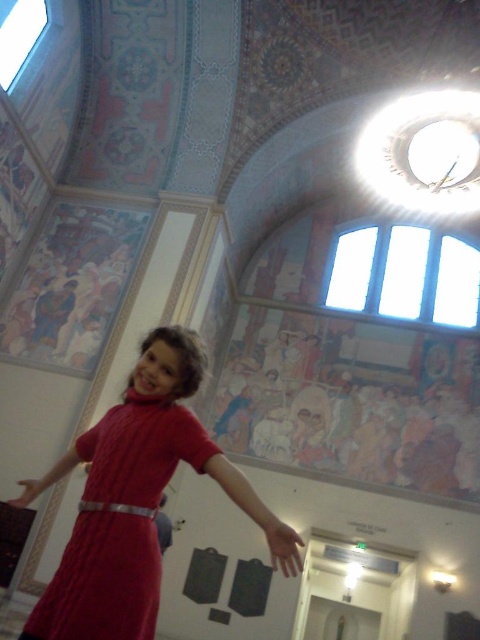
Question: From the image, what is the correct spatial relationship of cable-knit dress at center in relation to white leather belt at center?

Choices:
 (A) left
 (B) right

Answer: (B)

Question: In this image, where is cable-knit dress at center located relative to white leather belt at center?

Choices:
 (A) below
 (B) above

Answer: (B)

Question: Is cable-knit dress at center to the left of white leather belt at center from the viewer's perspective?

Choices:
 (A) yes
 (B) no

Answer: (B)

Question: Which object appears farthest from the camera in this image?

Choices:
 (A) white leather belt at center
 (B) cable-knit dress at center

Answer: (A)